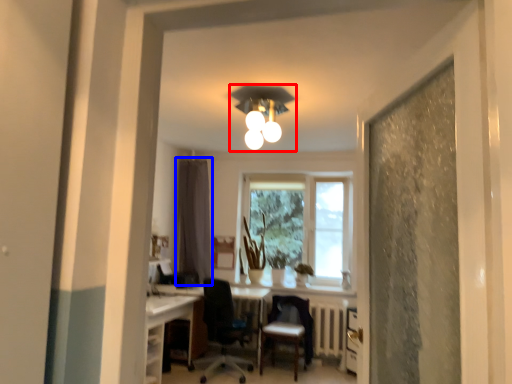
Question: Which of the following is the farthest to the observer, light fixture (highlighted by a red box) or curtain (highlighted by a blue box)?

Choices:
 (A) light fixture
 (B) curtain

Answer: (B)